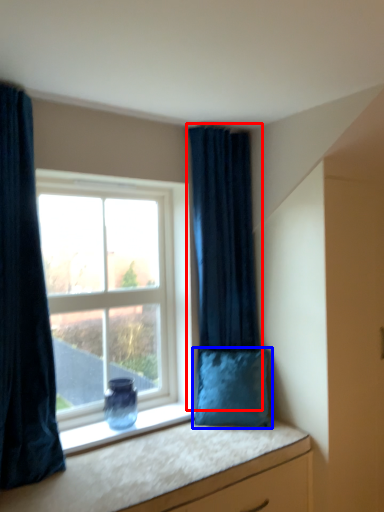
Question: Which object appears closest to the camera in this image, curtain (highlighted by a red box) or pillow (highlighted by a blue box)?

Choices:
 (A) curtain
 (B) pillow

Answer: (B)